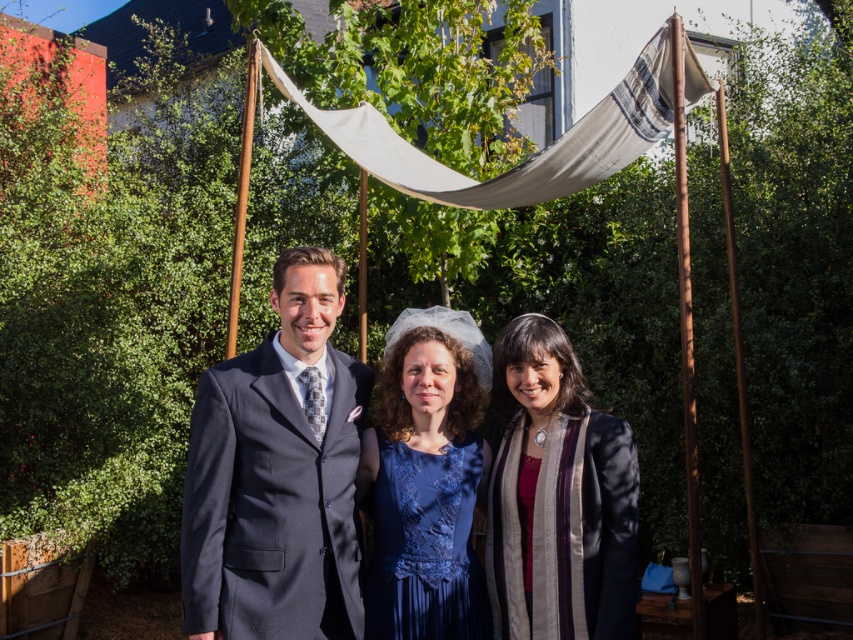
Does navy blue suit at center have a lesser width compared to blue lace dress at center?

Incorrect, navy blue suit at center's width is not less than blue lace dress at center's.

Can you confirm if navy blue suit at center is taller than blue lace dress at center?

Correct, navy blue suit at center is much taller as blue lace dress at center.

The width and height of the screenshot is (853, 640). I want to click on navy blue suit at center, so click(x=277, y=474).

Based on the photo, can you confirm if silky beige scarf at center is smaller than dark gray suit at center?

Yes.

Can you confirm if silky beige scarf at center is positioned to the left of dark gray suit at center?

In fact, silky beige scarf at center is to the right of dark gray suit at center.

In order to click on silky beige scarf at center in this screenshot , I will do `click(556, 497)`.

Find the location of a particular element. The width and height of the screenshot is (853, 640). silky beige scarf at center is located at coordinates (556, 497).

Can you confirm if navy blue suit at center is positioned to the right of white canvas canopy at upper center?

In fact, navy blue suit at center is to the left of white canvas canopy at upper center.

Is navy blue suit at center above white canvas canopy at upper center?

No, navy blue suit at center is not above white canvas canopy at upper center.

Locate an element on the screen. navy blue suit at center is located at coordinates (277, 474).